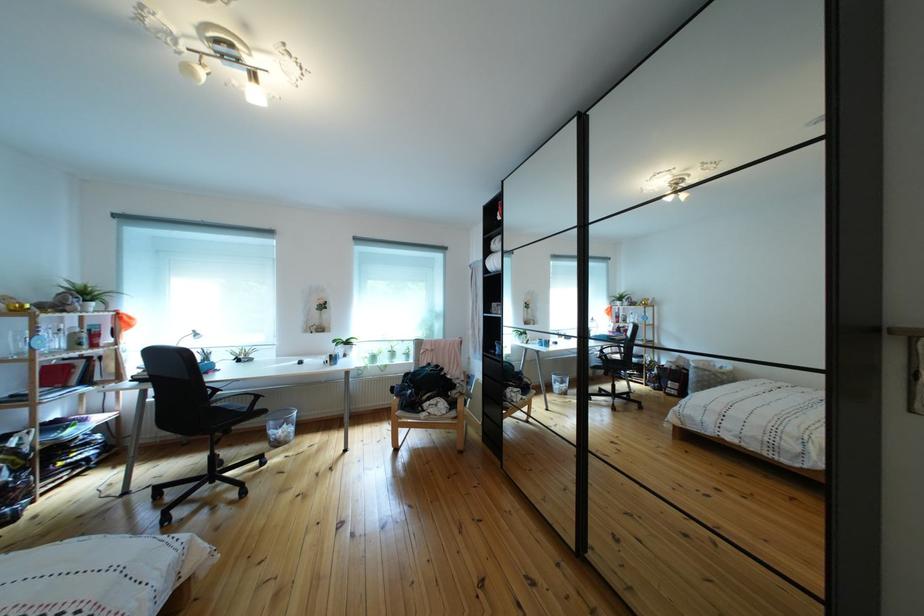
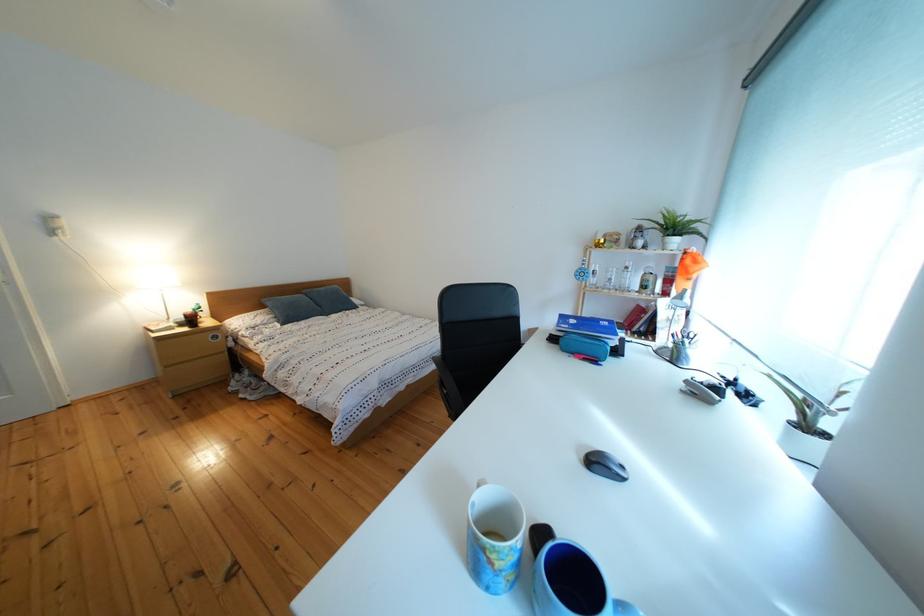
Question: I am providing you with two images of the same scene from different viewpoints. After the viewpoint changes to image2, which objects are now occluded?

Choices:
 (A) black chair armrest
 (B) blue tufted pillow
 (C) grey office stapler
 (D) clear glass bottle

Answer: (A)